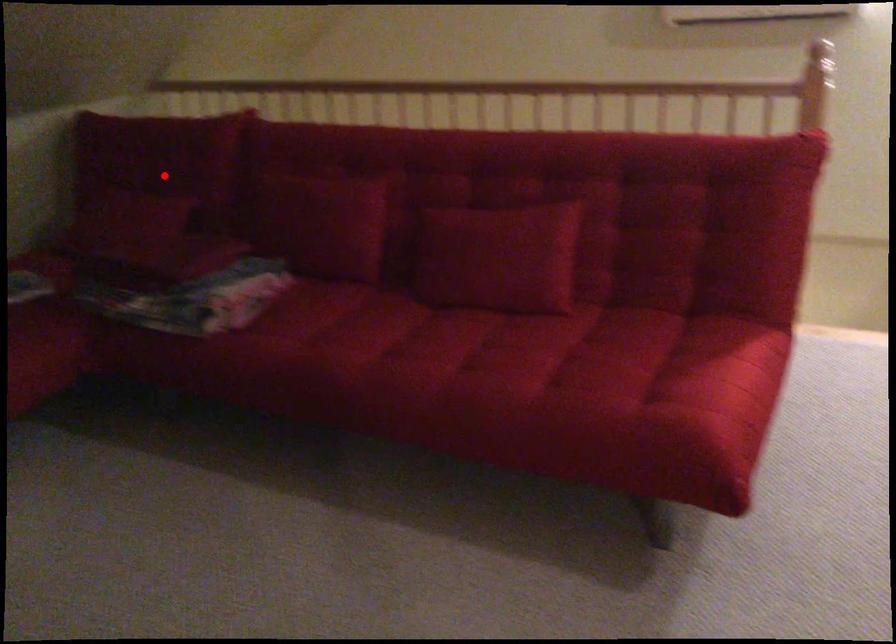
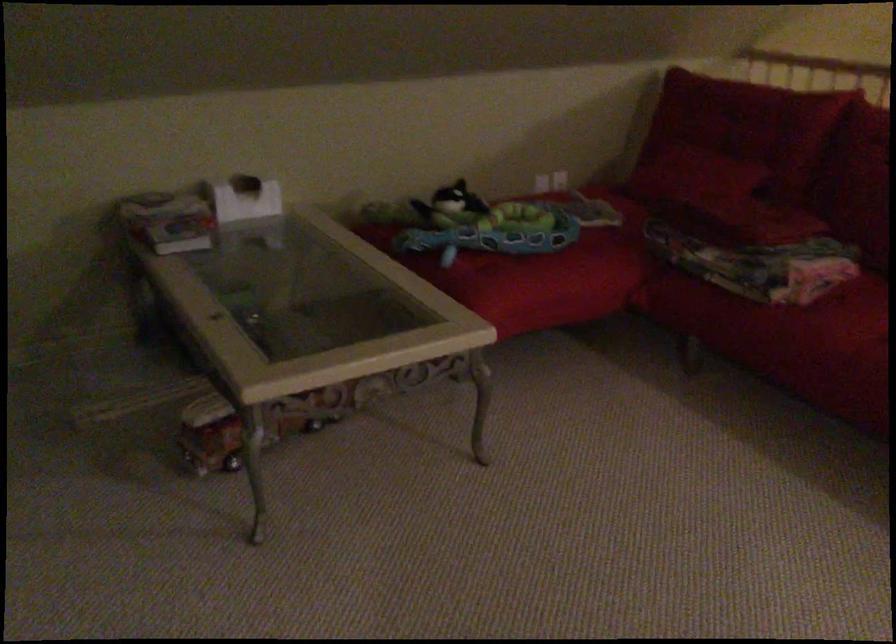
Where in the second image is the point corresponding to the highlighted location from the first image?

(745, 125)